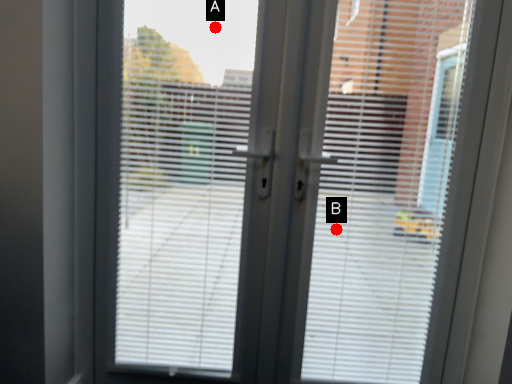
Question: Two points are circled on the image, labeled by A and B beside each circle. Which point is farther to the camera?

Choices:
 (A) A is further
 (B) B is further

Answer: (B)